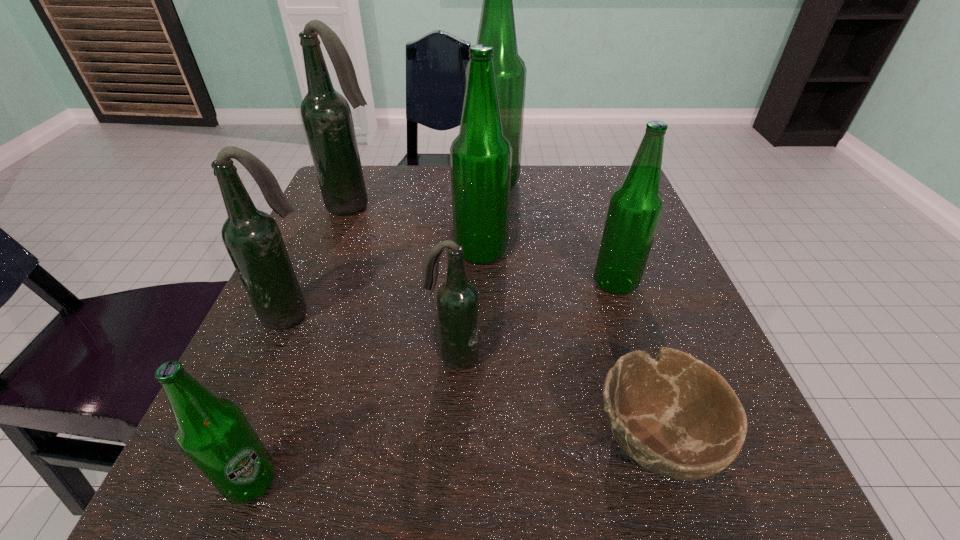
Choose which beer bottle is the fourth nearest neighbor to the farthest dark beer bottle. Please provide its 2D coordinates. Your answer should be formatted as a tuple, i.e. [(x, y)], where the tuple contains the x and y coordinates of a point satisfying the conditions above.

[(457, 299)]

The width and height of the screenshot is (960, 540). Find the location of `beer bottle that is the closest to the farthest dark beer bottle`. beer bottle that is the closest to the farthest dark beer bottle is located at coordinates (480, 156).

Locate an element on the screen. This screenshot has height=540, width=960. the closest green beer bottle to the second nearest dark beer bottle is located at coordinates (214, 433).

This screenshot has width=960, height=540. Identify the location of the second closest green beer bottle relative to the second smallest green beer bottle. (497, 25).

You are a GUI agent. You are given a task and a screenshot of the screen. Output one action in this format:
    pyautogui.click(x=<x>, y=<y>)
    Task: Click on the closest dark beer bottle to the shortest object
    This screenshot has width=960, height=540.
    Given the screenshot: What is the action you would take?
    pyautogui.click(x=457, y=299)

Image resolution: width=960 pixels, height=540 pixels. In order to click on dark beer bottle identified as the third closest to the second biggest green beer bottle in this screenshot , I will do [x=252, y=238].

The height and width of the screenshot is (540, 960). In order to click on vacant space that satisfies the following two spatial constraints: 1. on the front side of the second nearest dark beer bottle; 2. on the left side of the bowl in this screenshot , I will do `click(236, 437)`.

Image resolution: width=960 pixels, height=540 pixels. In order to click on free spot that satisfies the following two spatial constraints: 1. on the label of the third biggest green beer bottle; 2. on the front side of the bowl in this screenshot , I will do `click(667, 437)`.

Find the location of a particular element. The height and width of the screenshot is (540, 960). free spot that satisfies the following two spatial constraints: 1. on the label of the rightmost beer bottle; 2. on the front side of the second nearest dark beer bottle is located at coordinates (626, 314).

This screenshot has height=540, width=960. In order to click on free location that satisfies the following two spatial constraints: 1. on the front side of the biggest dark beer bottle; 2. on the right side of the sixth farthest object in this screenshot , I will do `click(298, 357)`.